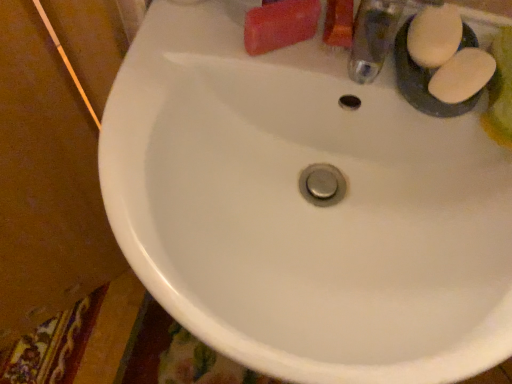
The image size is (512, 384). Identify the location of vacant space to the left of matte pink bar of soap at upper right, placed as the third soap when sorted from right to left. (185, 48).